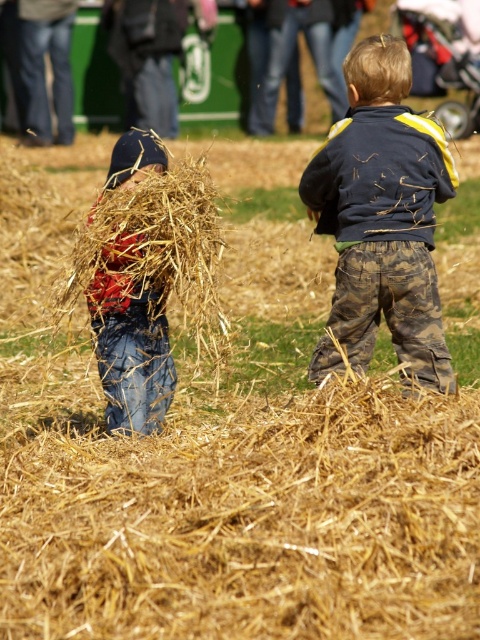
Does point (444, 163) come closer to viewer compared to point (147, 376)?

Yes, point (444, 163) is closer to viewer.

Between camouflage pants at center and denim jeans at left, which one appears on the right side from the viewer's perspective?

Positioned to the right is camouflage pants at center.

The height and width of the screenshot is (640, 480). What do you see at coordinates (384, 212) in the screenshot?
I see `camouflage pants at center` at bounding box center [384, 212].

Find the location of a particular element. The height and width of the screenshot is (640, 480). camouflage pants at center is located at coordinates (384, 212).